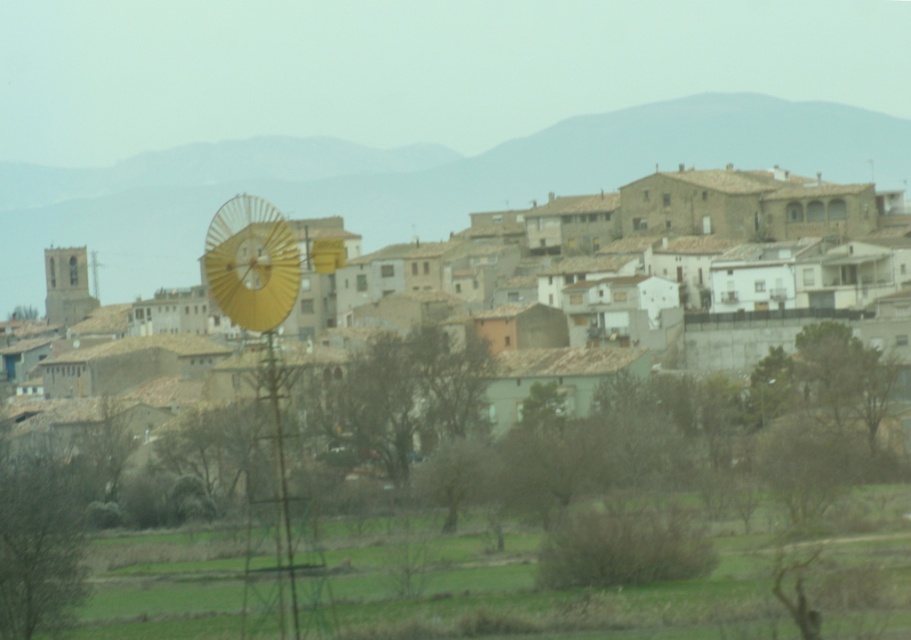
Measure the distance between point (x=545, y=609) and camera.

Point (x=545, y=609) is 296.16 feet away from camera.

Between green grass at lower center and metallic yellow windmill at center-left, which one appears on the left side from the viewer's perspective?

Positioned to the left is metallic yellow windmill at center-left.

Who is more distant from viewer, (908,564) or (242,291)?

The point (908,564) is more distant.

Image resolution: width=911 pixels, height=640 pixels. Find the location of `green grass at lower center`. green grass at lower center is located at coordinates (549, 589).

From the picture: Does gold metallic windmill at center have a lesser width compared to metallic yellow windmill at center-left?

No, gold metallic windmill at center is not thinner than metallic yellow windmill at center-left.

Between point (779, 344) and point (293, 246), which one is positioned in front?

Positioned in front is point (293, 246).

Find the location of a particular element. gold metallic windmill at center is located at coordinates (674, 253).

What are the coordinates of `gold metallic windmill at center` in the screenshot? It's located at (674, 253).

Does point (428, 636) come in front of point (871, 282)?

Yes.

The height and width of the screenshot is (640, 911). What do you see at coordinates (549, 589) in the screenshot?
I see `green grass at lower center` at bounding box center [549, 589].

You are a GUI agent. You are given a task and a screenshot of the screen. Output one action in this format:
    pyautogui.click(x=<x>, y=<y>)
    Task: Click on the green grass at lower center
    
    Given the screenshot: What is the action you would take?
    pyautogui.click(x=549, y=589)